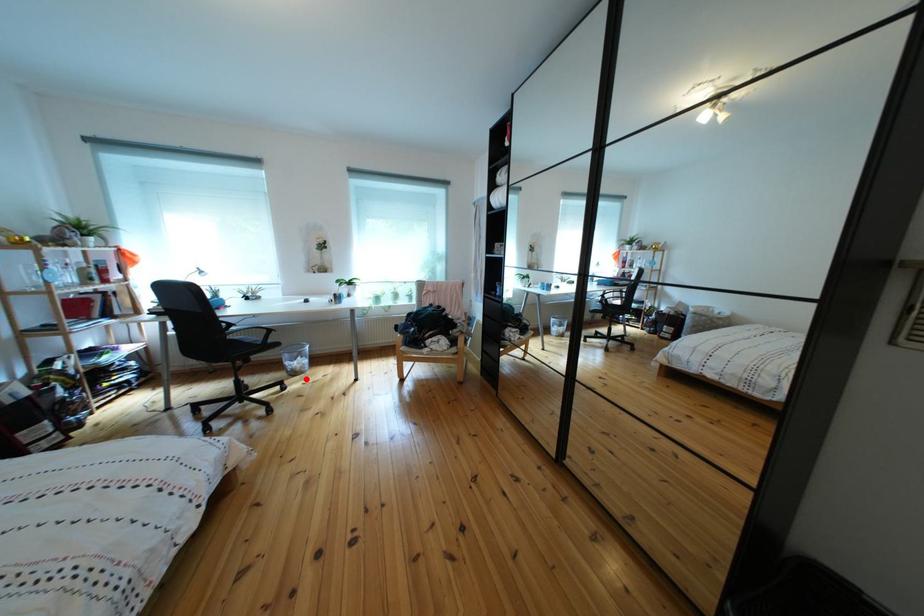
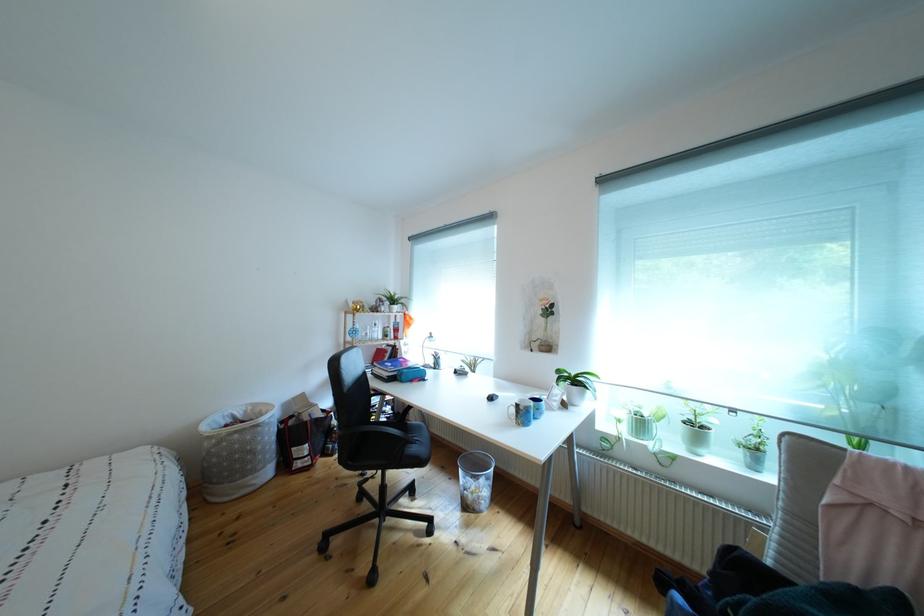
Question: I am providing you with two images of the same scene from different viewpoints. In image1, a red point is highlighted. Considering the same 3D point in image2, which of the following is correct?

Choices:
 (A) It is closer
 (B) It is farther

Answer: (B)